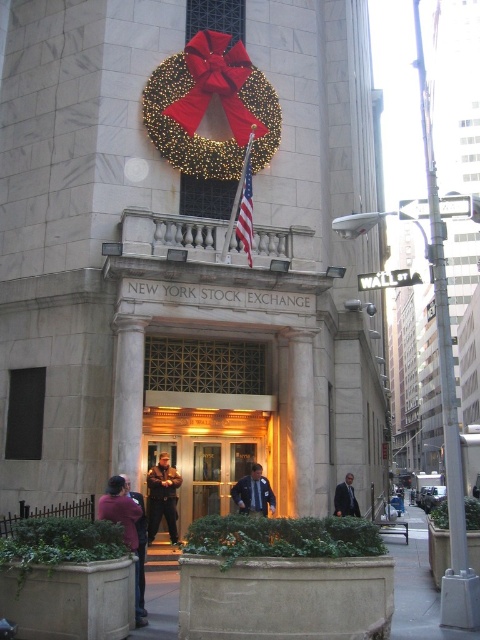
Question: Does brown leather jacket at center appear on the left side of dark blue uniform at center?

Choices:
 (A) no
 (B) yes

Answer: (B)

Question: Which object appears closest to the camera in this image?

Choices:
 (A) dark purple jacket at lower left
 (B) iridescent gold wreath at upper center

Answer: (A)

Question: Which point is farther to the camera?

Choices:
 (A) dark purple jacket at lower left
 (B) dark gray suit at center
 (C) iridescent gold wreath at upper center
 (D) brown leather jacket at center

Answer: (B)

Question: Which object is farther from the camera taking this photo?

Choices:
 (A) american flag at center
 (B) dark blue uniform at center
 (C) dark gray suit at center
 (D) iridescent gold wreath at upper center

Answer: (C)

Question: Can you confirm if iridescent gold wreath at upper center is positioned below dark blue uniform at center?

Choices:
 (A) yes
 (B) no

Answer: (B)

Question: Where is dark purple jacket at lower left located in relation to dark gray suit at center in the image?

Choices:
 (A) left
 (B) right

Answer: (A)